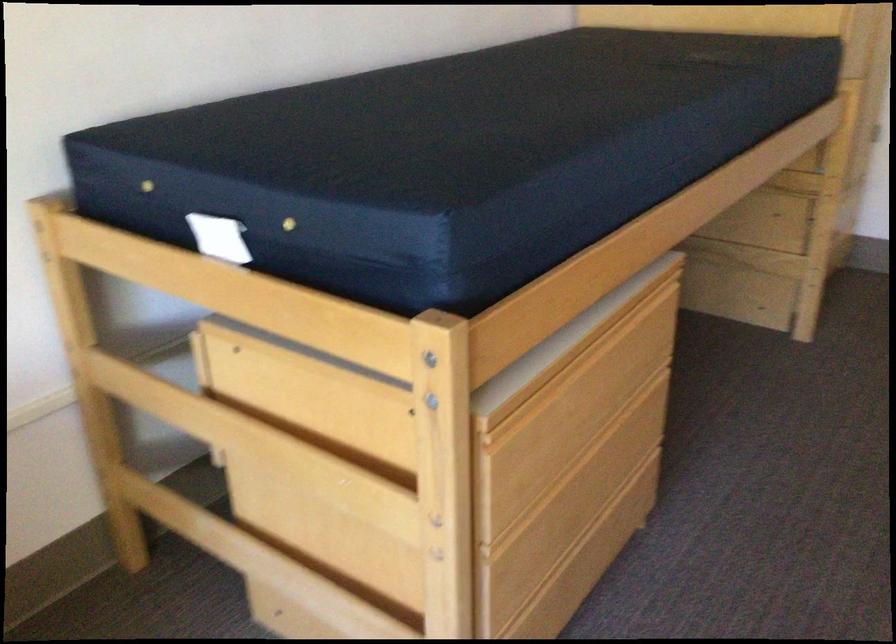
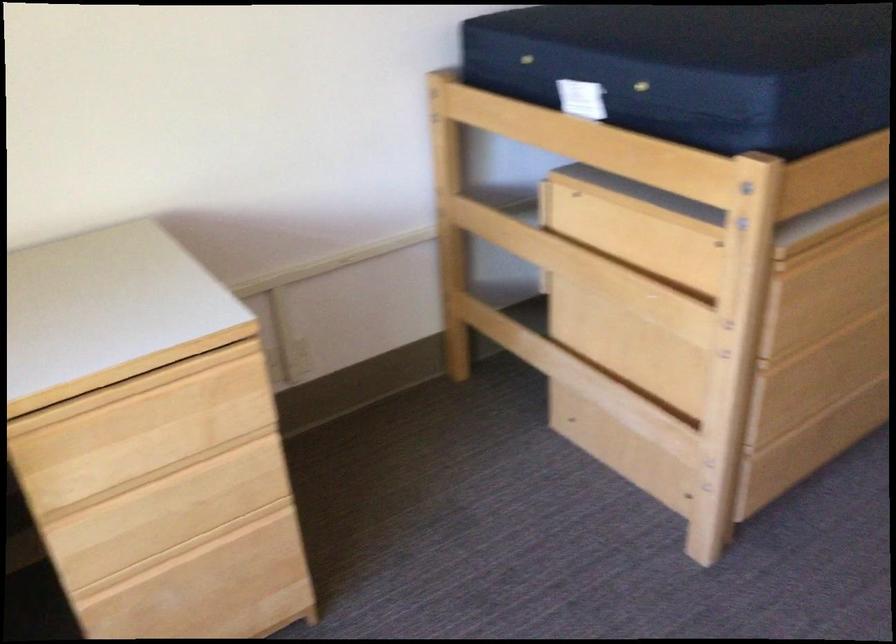
The point at (394, 386) is marked in the first image. Where is the corresponding point in the second image?

(703, 221)